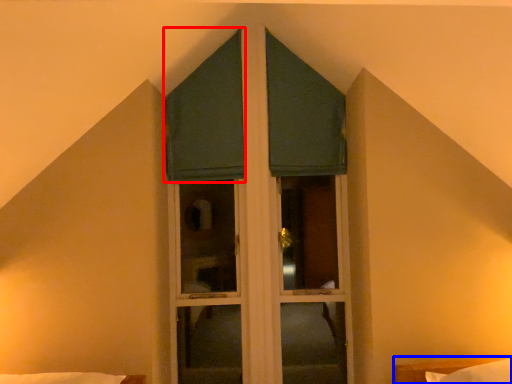
Question: Which object is closer to the camera taking this photo, curtain (highlighted by a red box) or bed (highlighted by a blue box)?

Choices:
 (A) curtain
 (B) bed

Answer: (B)